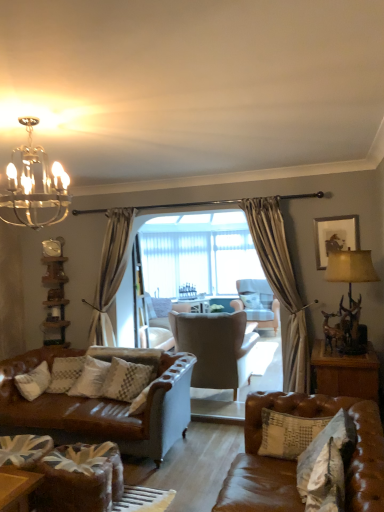
Question: Would you say white textured pillow at lower right, arranged as the first pillow when viewed from the front, is inside or outside white textured pillow at center, arranged as the 3th pillow when viewed from the front?

Choices:
 (A) outside
 (B) inside

Answer: (A)

Question: Considering their positions, is white textured pillow at lower right, the 4th pillow positioned from the back, located in front of or behind white textured pillow at center, arranged as the 3th pillow when viewed from the front?

Choices:
 (A) behind
 (B) front

Answer: (B)

Question: Which of these objects is positioned farthest from the gold metallic chandelier at upper left?

Choices:
 (A) white textured pillow at lower right, acting as the second pillow starting from the right
 (B) clear glass screen door at center
 (C) brown leather couch at lower right
 (D) suede wingback chair at center, the 2th chair positioned from the back
 (E) wooden framed picture at upper right

Answer: (B)

Question: Based on their relative distances, which object is farther from the gold metallic chandelier at upper left?

Choices:
 (A) white textured pillow at lower right, the third pillow positioned from the back
 (B) white textured pillow at center, which is the first pillow in back-to-front order
 (C) white textured pillow at lower right, arranged as the first pillow when viewed from the front
 (D) suede wingback chair at center, placed as the 1th chair when sorted from front to back
 (E) white textured pillow at center, arranged as the 3th pillow when viewed from the front

Answer: (B)